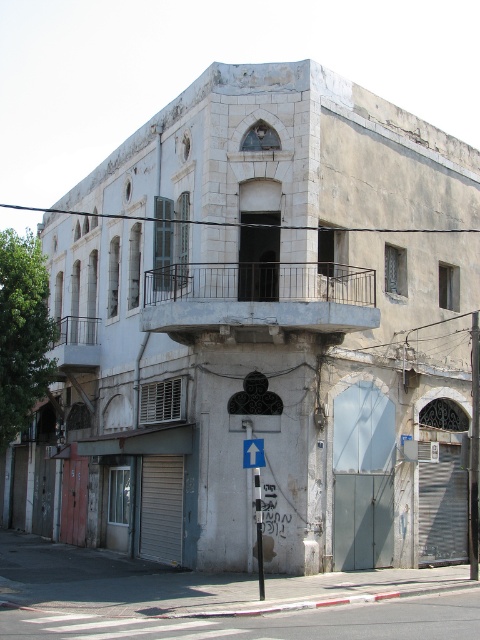
Is white metal balcony at center shorter than blue plastic sign at upper center?

Incorrect, white metal balcony at center's height does not fall short of blue plastic sign at upper center's.

Is white metal balcony at center closer to camera compared to blue plastic sign at upper center?

No, it is behind blue plastic sign at upper center.

Locate an element on the screen. The image size is (480, 640). white metal balcony at center is located at coordinates (259, 298).